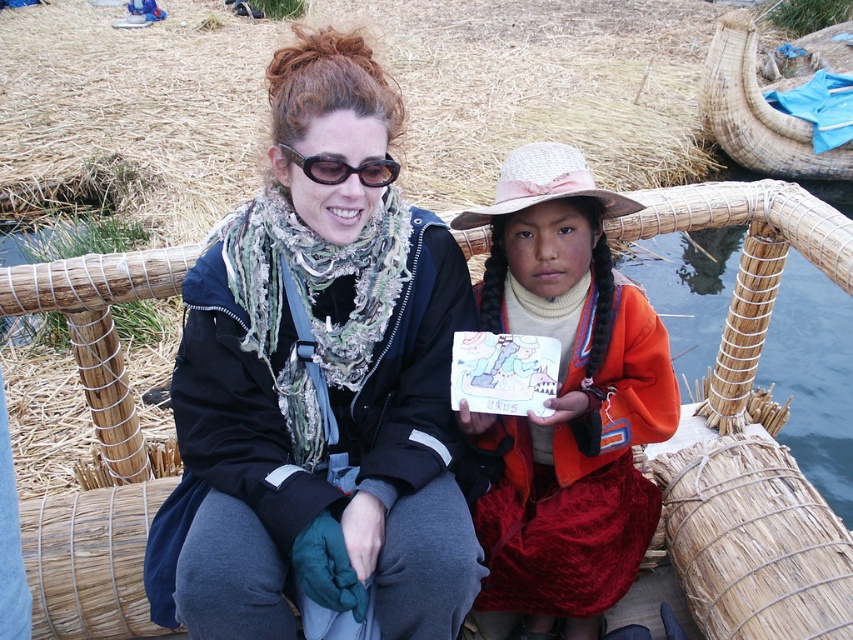
Question: In this image, where is woven straw boat at center located relative to colored paper drawing at center?

Choices:
 (A) left
 (B) right

Answer: (B)

Question: Is velvet orange dress at center to the right of colored paper drawing at center from the viewer's perspective?

Choices:
 (A) yes
 (B) no

Answer: (A)

Question: Which of the following is the closest to the observer?

Choices:
 (A) velvet orange dress at center
 (B) colored paper drawing at center
 (C) matte black jacket at center
 (D) black plastic sunglasses at upper center

Answer: (C)

Question: Among these points, which one is nearest to the camera?

Choices:
 (A) (546, 440)
 (B) (483, 401)
 (C) (335, 179)

Answer: (C)

Question: Is matte black jacket at center further to the viewer compared to velvet orange dress at center?

Choices:
 (A) yes
 (B) no

Answer: (B)

Question: Which object appears farthest from the camera in this image?

Choices:
 (A) woven straw boat at center
 (B) matte black jacket at center
 (C) black plastic sunglasses at upper center

Answer: (A)